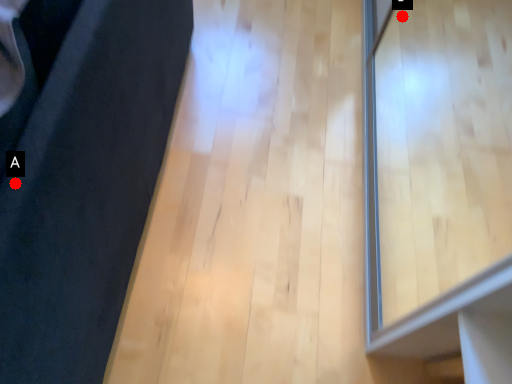
Question: Two points are circled on the image, labeled by A and B beside each circle. Among these points, which one is nearest to the camera?

Choices:
 (A) A is closer
 (B) B is closer

Answer: (A)